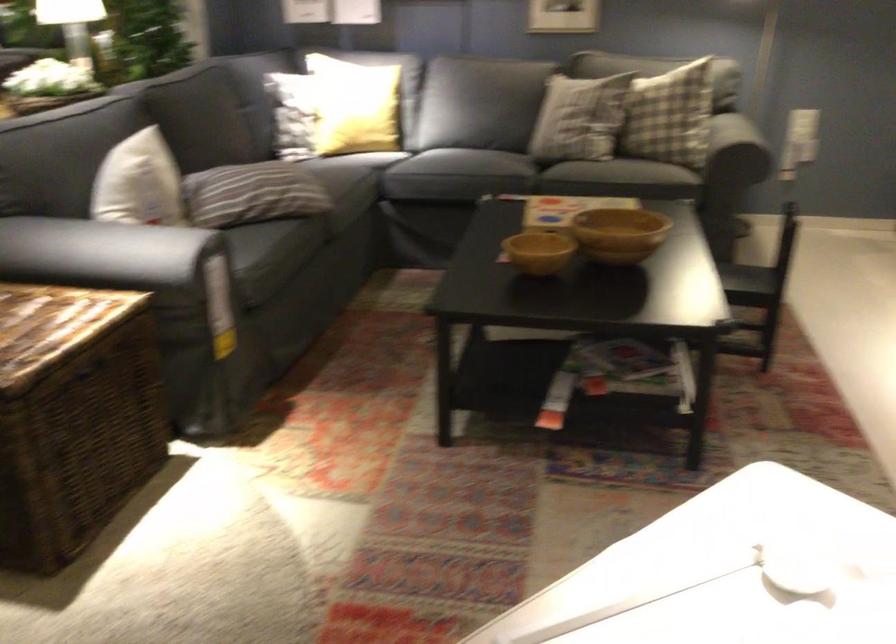
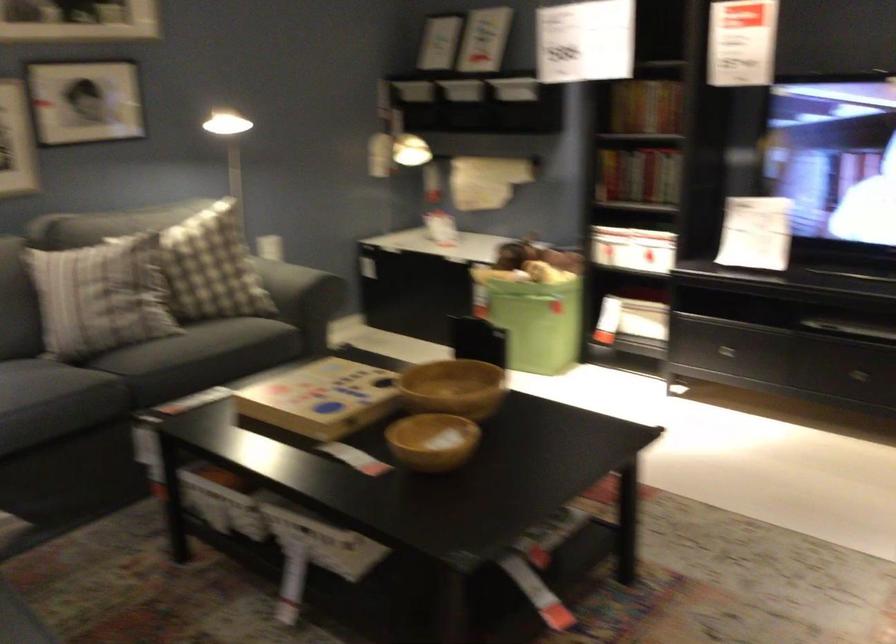
Question: I am providing you with two images of the same scene from different viewpoints. Please identify which objects are invisible in image2.

Choices:
 (A) drawer handle
 (B) dark sofa armrest
 (C) brown wooden bowl
 (D) guitar pickup switch

Answer: (B)